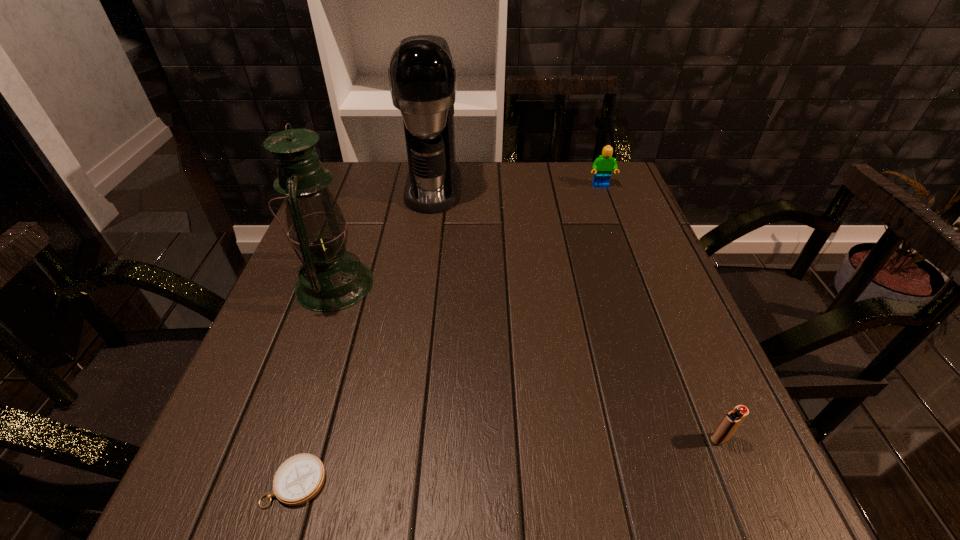
Find the location of a particular element. free spot located 0.330m on the back of the fourth farthest object is located at coordinates (657, 288).

Identify the location of vacant space situated on the back of the nearest object. (324, 389).

Locate an element on the screen. This screenshot has height=540, width=960. coffee maker that is positioned at the far edge is located at coordinates (423, 81).

This screenshot has height=540, width=960. I want to click on Lego at the far edge, so click(603, 166).

The image size is (960, 540). I want to click on object that is at the near edge, so click(x=299, y=479).

Where is `oil lamp that is positioned at the left edge`? oil lamp that is positioned at the left edge is located at coordinates (331, 279).

Where is `compass that is at the left edge`? The image size is (960, 540). compass that is at the left edge is located at coordinates (299, 479).

Identify the location of Lego positioned at the right edge. (603, 166).

Image resolution: width=960 pixels, height=540 pixels. I want to click on igniter at the right edge, so click(730, 423).

This screenshot has height=540, width=960. Find the location of `object positioned at the near left corner`. object positioned at the near left corner is located at coordinates (299, 479).